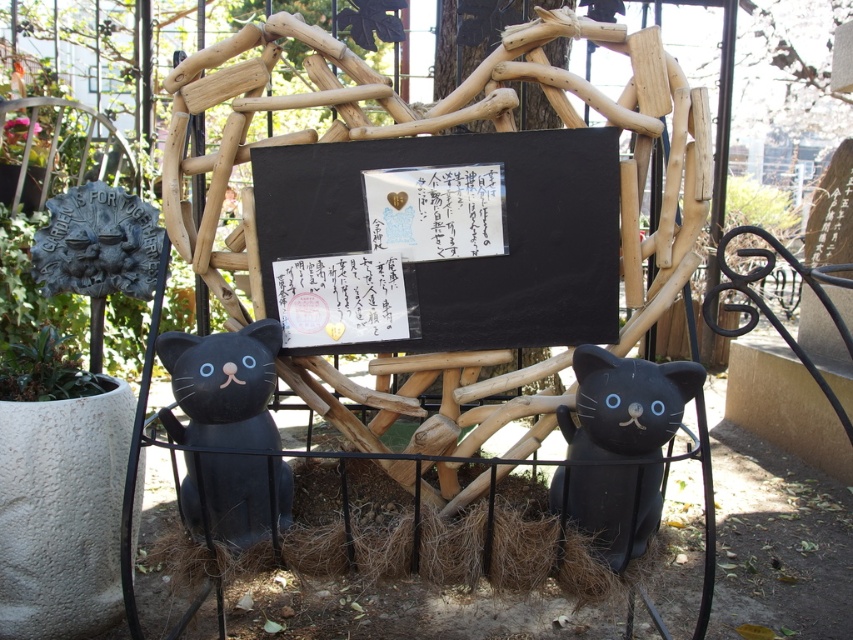
You are standing in front of the blackboard framed by wooden branches. There is a brown straw marked at point (521, 538). Can you determine the position of the brown straw relative to the blackboard?

The brown straw at center is represented by point (521, 538), so it is located at the center of the blackboard framed by wooden branches.

You are a small toy mouse that is 3 inches long. You want to roll from the brown straw at center to the matte black cat at lower right. Is there enough space for you to move freely between them?

The distance between the brown straw at center and the matte black cat at lower right is 9.57 inches, which is more than enough space for a 3 inch long toy mouse to move freely between them.